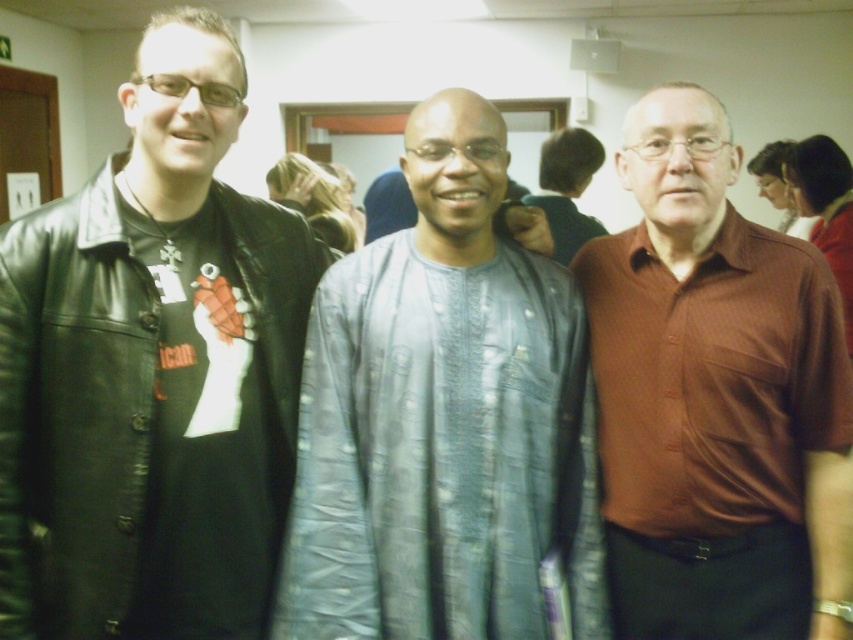
Is point (502, 243) positioned behind point (569, 129)?

No, it is not.

Is silvery textured fabric at center shorter than gray textured shirt at center?

Incorrect, silvery textured fabric at center's height does not fall short of gray textured shirt at center's.

The image size is (853, 640). Describe the element at coordinates (440, 419) in the screenshot. I see `silvery textured fabric at center` at that location.

Locate an element on the screen. This screenshot has width=853, height=640. silvery textured fabric at center is located at coordinates (440, 419).

Is brown smooth shirt at center bigger than gray textured shirt at center?

No, brown smooth shirt at center is not bigger than gray textured shirt at center.

Find the location of a particular element. brown smooth shirt at center is located at coordinates (715, 397).

Can you confirm if silvery textured fabric at center is positioned below brown smooth shirt at center?

Yes, silvery textured fabric at center is below brown smooth shirt at center.

Is silvery textured fabric at center taller than brown smooth shirt at center?

In fact, silvery textured fabric at center may be shorter than brown smooth shirt at center.

Find the location of a particular element. silvery textured fabric at center is located at coordinates 440,419.